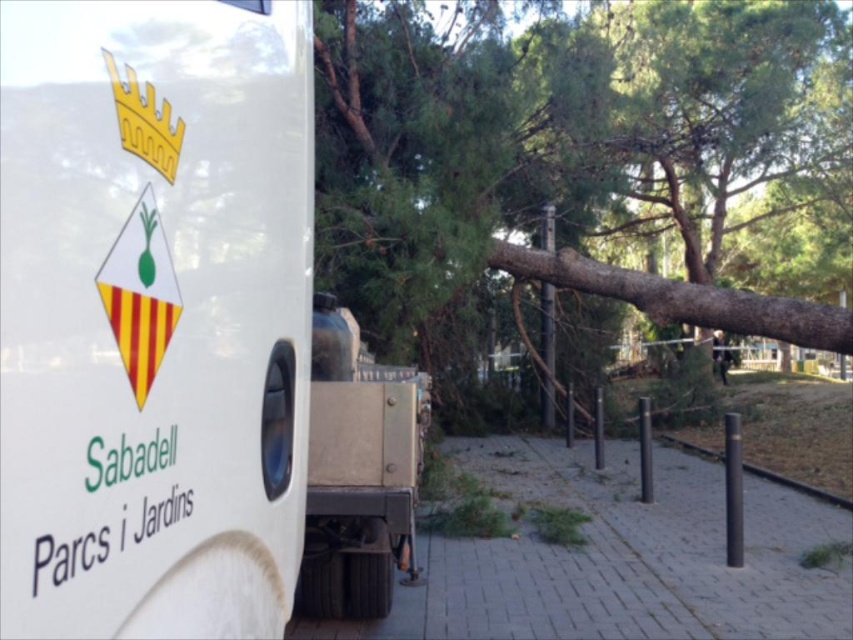
You are a pedestrian trying to cross the pathway blocked by the fallen tree. You see the white matte truck at center and the brown rough wood at center. Which object is closer to the ground?

The white matte truck at center is located below brown rough wood at center, so the white matte truck at center is closer to the ground.

You are a pedestrian trying to cross the pathway where the brown rough wood and metallic silver truck are both at center. Is the brown rough wood at center blocking your path to the metallic silver truck at center?

The brown rough wood at center is positioned over metallic silver truck at center, so yes, the brown rough wood at center is blocking the path to the metallic silver truck at center.